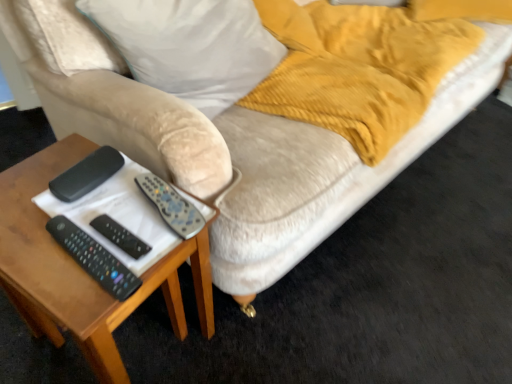
Image resolution: width=512 pixels, height=384 pixels. What are the coordinates of `vacant space behind black plastic remote at center, positioned as the second remote in top-to-bottom order` in the screenshot? It's located at (116, 199).